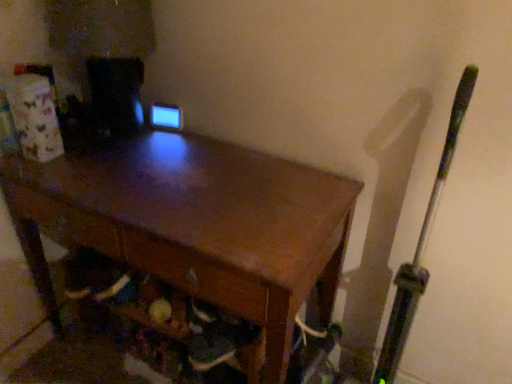
Where is `free point above wooden desk at center (from a real-world perspective)`? The height and width of the screenshot is (384, 512). free point above wooden desk at center (from a real-world perspective) is located at coordinates (157, 172).